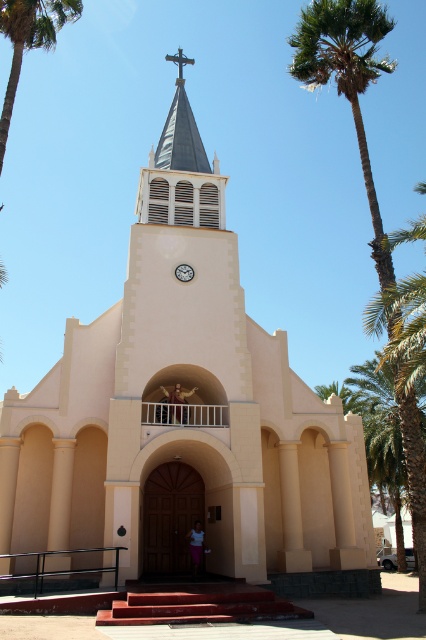
You are standing in front of the church and want to take a photo of the smooth beige statue at upper center. However, you notice the green leafy palm tree at upper left might be blocking the view. Based on their positions, will the palm tree block the statue in your photo?

The green leafy palm tree at upper left is to the left of the smooth beige statue at upper center, so it will not block the statue in your photo since it is positioned to the left side.

You are standing at the entrance of the church and see the smooth beige statue at upper center and the white fabric person at center. Which object is positioned to the left of the other?

The smooth beige statue at upper center is to the left of the white fabric person at center.